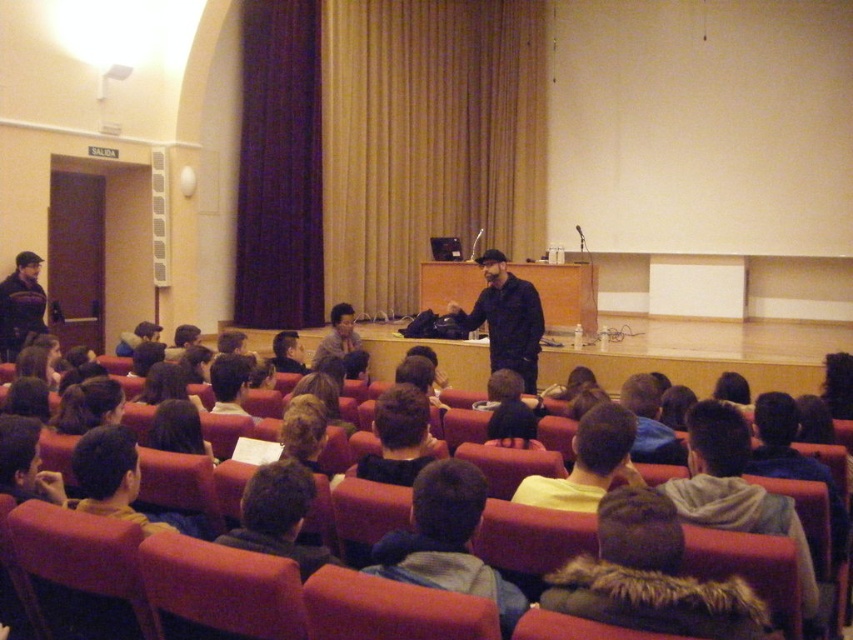
Who is lower down, dark blue hoodie at center or black fabric head at center?

Positioned lower is dark blue hoodie at center.

Between dark blue hoodie at center and black fabric head at center, which one has less height?

Standing shorter between the two is black fabric head at center.

Does point (393, 548) come closer to viewer compared to point (415, 428)?

That is True.

Identify the location of dark blue hoodie at center. This screenshot has height=640, width=853. (445, 541).

Is dark blue hoodie at center smaller than dark brown hair at lower left?

No, dark blue hoodie at center is not smaller than dark brown hair at lower left.

Locate an element on the screen. dark blue hoodie at center is located at coordinates (445, 541).

Can you confirm if dark brown hair at center is positioned to the right of yellow cotton shirt at lower center?

No, dark brown hair at center is not to the right of yellow cotton shirt at lower center.

Is the position of dark brown hair at center more distant than that of yellow cotton shirt at lower center?

No, it is in front of yellow cotton shirt at lower center.

You are a GUI agent. You are given a task and a screenshot of the screen. Output one action in this format:
    pyautogui.click(x=<x>, y=<y>)
    Task: Click on the dark brown hair at center
    The height and width of the screenshot is (640, 853).
    Given the screenshot: What is the action you would take?
    pyautogui.click(x=277, y=516)